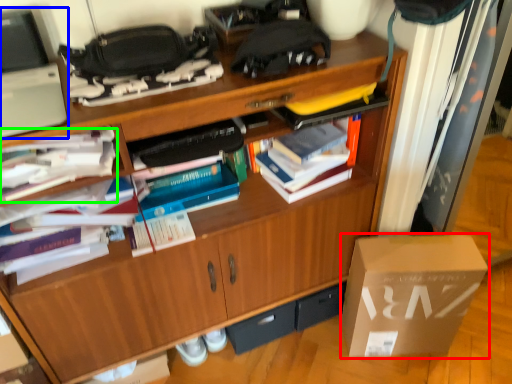
Question: Estimate the real-world distances between objects in this image. Which object is closer to box (highlighted by a red box), computer (highlighted by a blue box) or book (highlighted by a green box)?

Choices:
 (A) computer
 (B) book

Answer: (B)